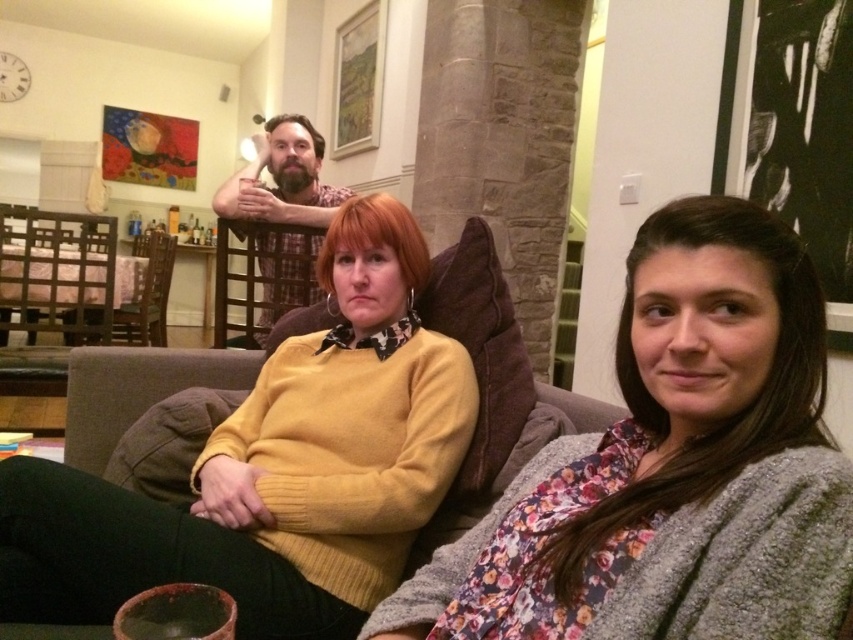
Question: Is floral fabric sweater at center above woodenchair at left?

Choices:
 (A) yes
 (B) no

Answer: (B)

Question: Which point is farther to the camera?

Choices:
 (A) floral fabric sweater at center
 (B) woodenchair at left
 (C) bearded man at upper center

Answer: (B)

Question: Does bearded man at upper center come in front of woodenchair at left?

Choices:
 (A) yes
 (B) no

Answer: (A)

Question: Estimate the real-world distances between objects in this image. Which object is farther from the floral fabric sweater at center?

Choices:
 (A) bearded man at upper center
 (B) woodenchair at left
 (C) yellow knit sweater at center

Answer: (B)

Question: Can you confirm if floral fabric sweater at center is positioned to the right of yellow knit sweater at center?

Choices:
 (A) no
 (B) yes

Answer: (B)

Question: Which is farther from the woodenchair at left?

Choices:
 (A) yellow knit sweater at center
 (B) bearded man at upper center
 (C) floral fabric sweater at center

Answer: (C)